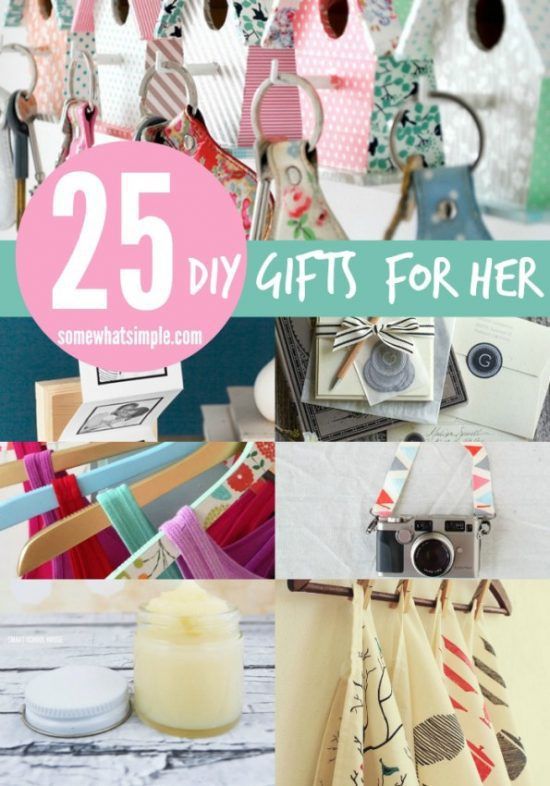
Image resolution: width=550 pixels, height=786 pixels. I want to click on hook, so click(x=276, y=75), click(x=168, y=70), click(x=75, y=54), click(x=15, y=46), click(x=421, y=96).